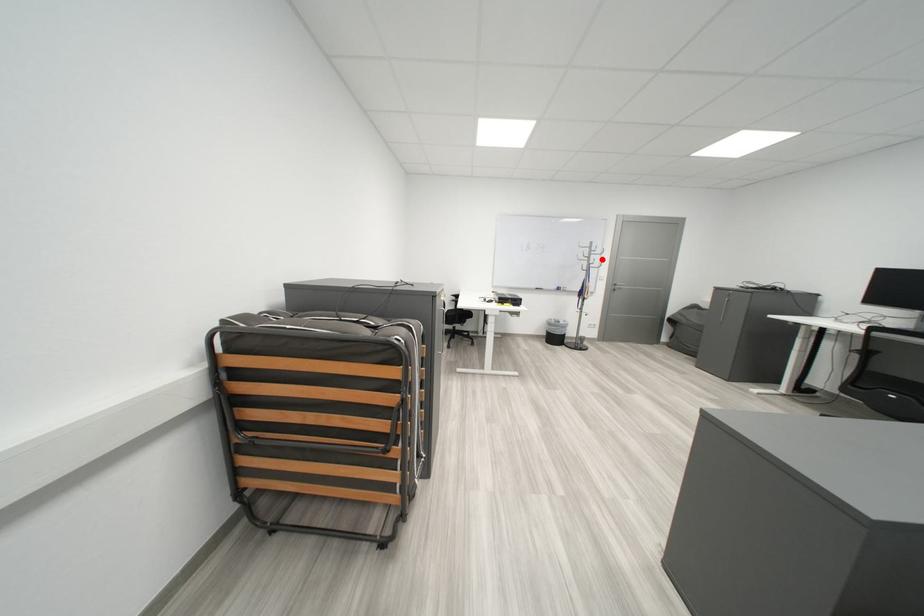
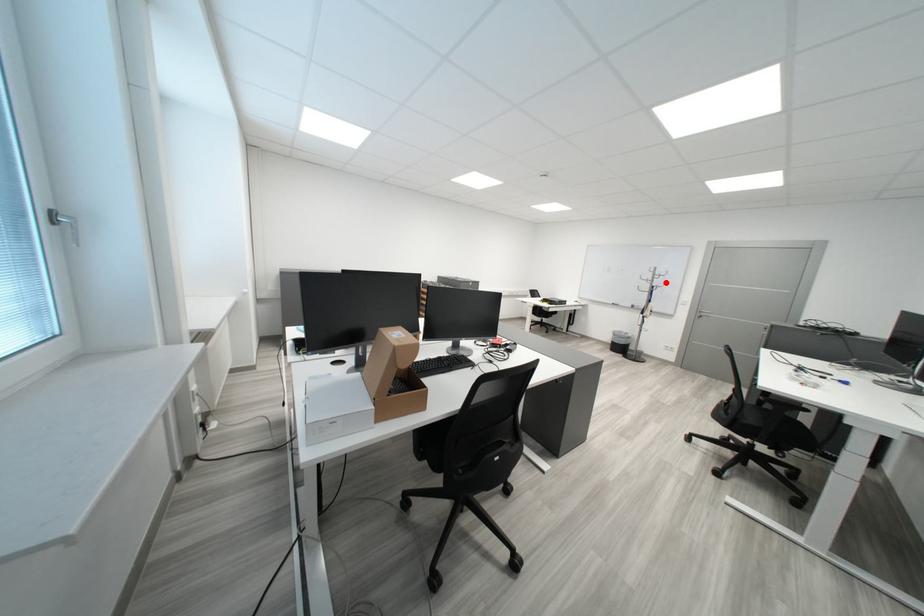
I am providing you with two images of the same scene from different viewpoints. A red point is marked on the first image and another point is marked on the second image. Are the points marked in image1 and image2 representing the same 3D position?

Yes